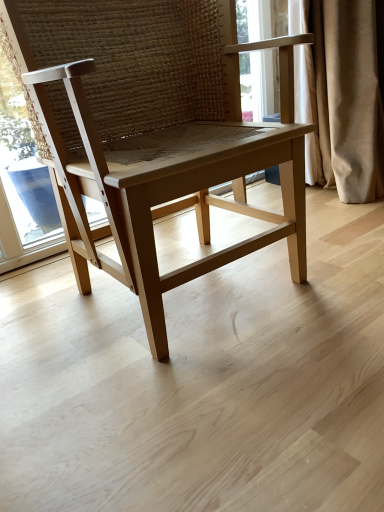
The image size is (384, 512). What are the coordinates of `vacant area located to the right-hand side of light wood chair at center` in the screenshot? It's located at (336, 265).